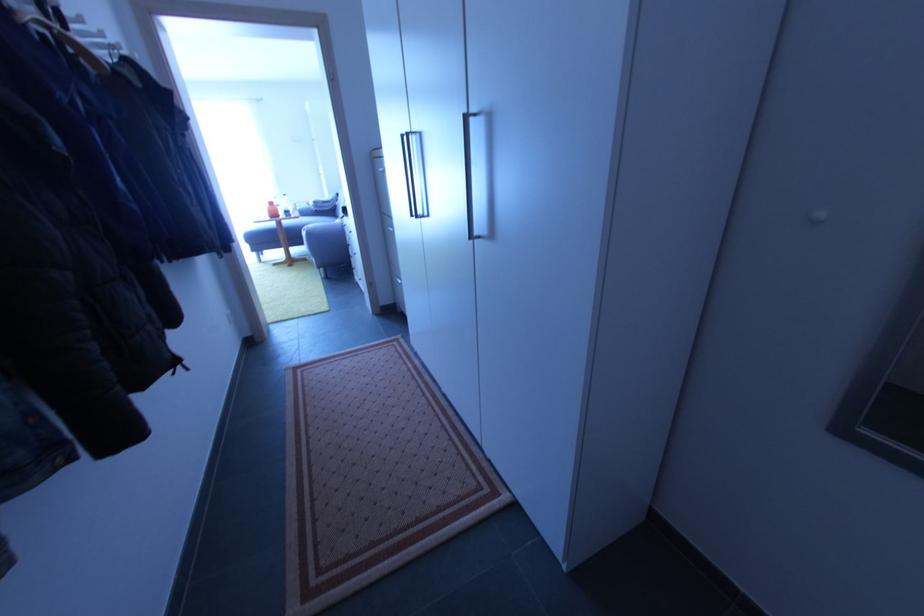
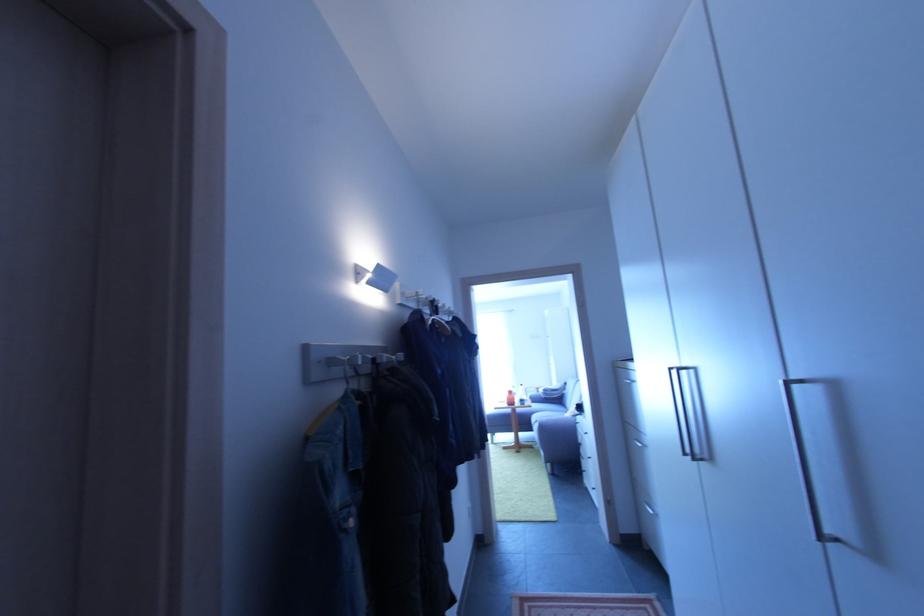
The first image is from the beginning of the video and the second image is from the end. How did the camera likely rotate when shooting the video?

The camera's rotation is toward left-up.